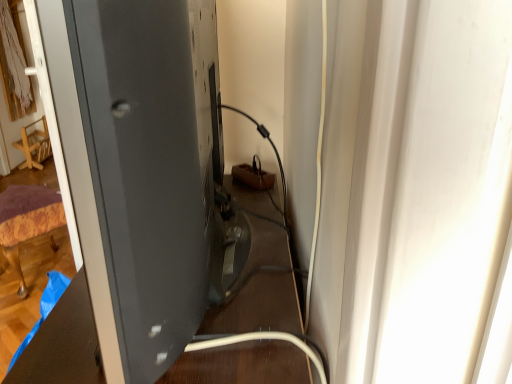
Question: Does velvet purple ottoman at lower left, positioned as the first furniture in bottom-to-top order, have a greater height compared to matte black monitor at left?

Choices:
 (A) yes
 (B) no

Answer: (B)

Question: From the image's perspective, would you say velvet purple ottoman at lower left, which ranks as the 2th furniture in top-to-bottom order, is shown under matte black monitor at left?

Choices:
 (A) no
 (B) yes

Answer: (B)

Question: Is velvet purple ottoman at lower left, arranged as the 1th furniture when viewed from the right, to the left of matte black monitor at left from the viewer's perspective?

Choices:
 (A) yes
 (B) no

Answer: (A)

Question: Is velvet purple ottoman at lower left, arranged as the 1th furniture when viewed from the right, positioned behind matte black monitor at left?

Choices:
 (A) no
 (B) yes

Answer: (B)

Question: Is velvet purple ottoman at lower left, which ranks as the 2th furniture in top-to-bottom order, not inside matte black monitor at left?

Choices:
 (A) yes
 (B) no

Answer: (A)

Question: Is black glossy table at center inside the boundaries of matte black monitor at left, or outside?

Choices:
 (A) outside
 (B) inside

Answer: (A)

Question: Relative to matte black monitor at left, is black glossy table at center in front or behind?

Choices:
 (A) behind
 (B) front

Answer: (A)

Question: Is black glossy table at center bigger or smaller than matte black monitor at left?

Choices:
 (A) big
 (B) small

Answer: (A)

Question: In terms of width, does black glossy table at center look wider or thinner when compared to matte black monitor at left?

Choices:
 (A) thin
 (B) wide

Answer: (B)

Question: Relative to matte black monitor at left, is wooden chair at left, the 2th furniture viewed from the front, in front or behind?

Choices:
 (A) front
 (B) behind

Answer: (B)

Question: Is wooden chair at left, the 1th furniture from the left, to the left or to the right of matte black monitor at left in the image?

Choices:
 (A) right
 (B) left

Answer: (B)

Question: Based on their sizes in the image, would you say wooden chair at left, the 1th furniture from the left, is bigger or smaller than matte black monitor at left?

Choices:
 (A) big
 (B) small

Answer: (B)

Question: Is wooden chair at left, the second furniture viewed from the right, wider or thinner than matte black monitor at left?

Choices:
 (A) thin
 (B) wide

Answer: (B)

Question: From a real-world perspective, is matte black monitor at left physically located above or below velvet purple ottoman at lower left, arranged as the 1th furniture when viewed from the right?

Choices:
 (A) above
 (B) below

Answer: (A)

Question: Looking at their shapes, would you say matte black monitor at left is wider or thinner than velvet purple ottoman at lower left, positioned as the first furniture in bottom-to-top order?

Choices:
 (A) wide
 (B) thin

Answer: (B)